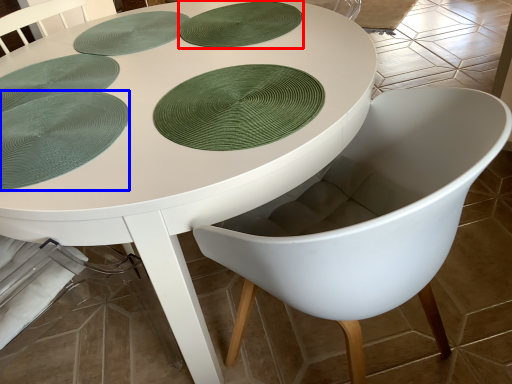
Question: Which object is further to the camera taking this photo, paper plate (highlighted by a red box) or paper plate (highlighted by a blue box)?

Choices:
 (A) paper plate
 (B) paper plate

Answer: (A)